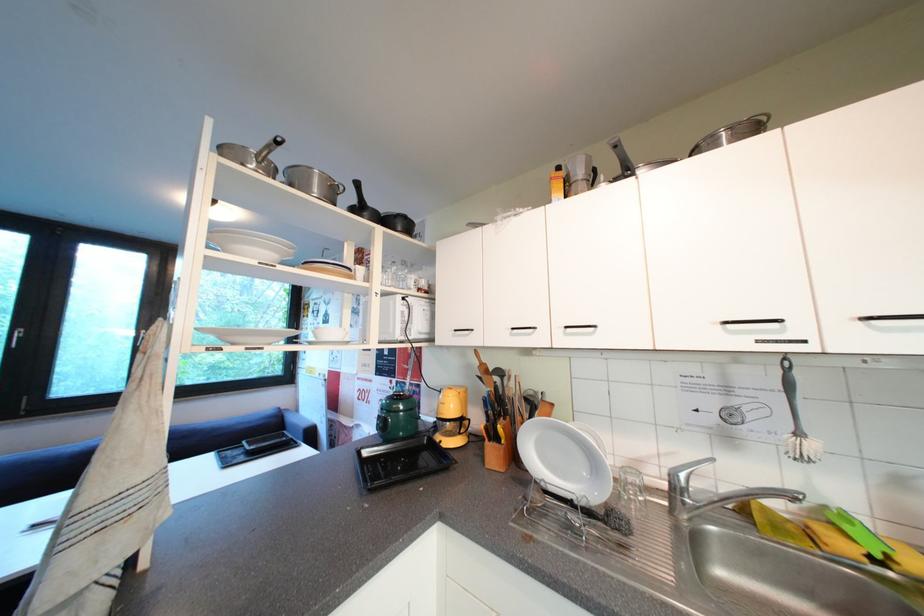
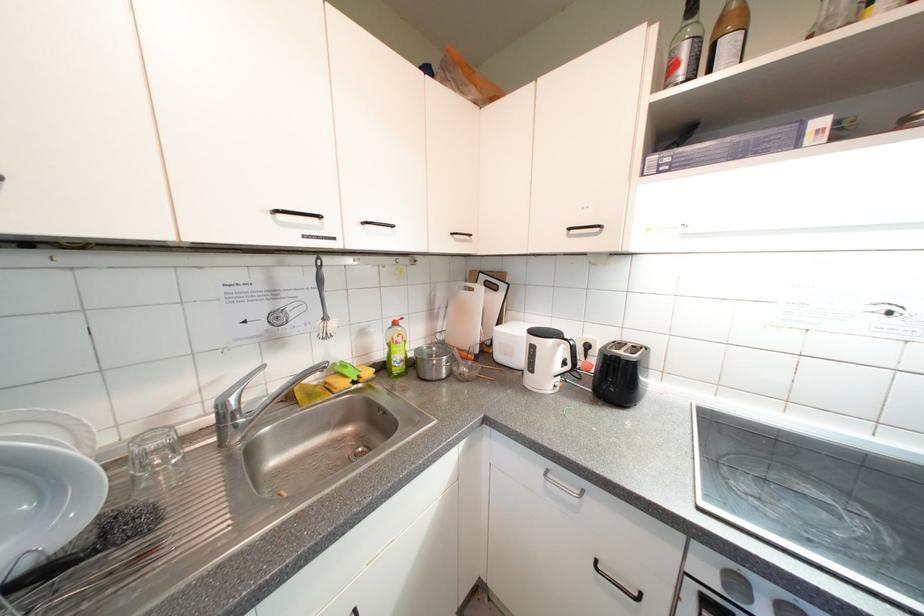
Where in the second image is the point corresponding to (x=684, y=490) from the first image?

(233, 419)